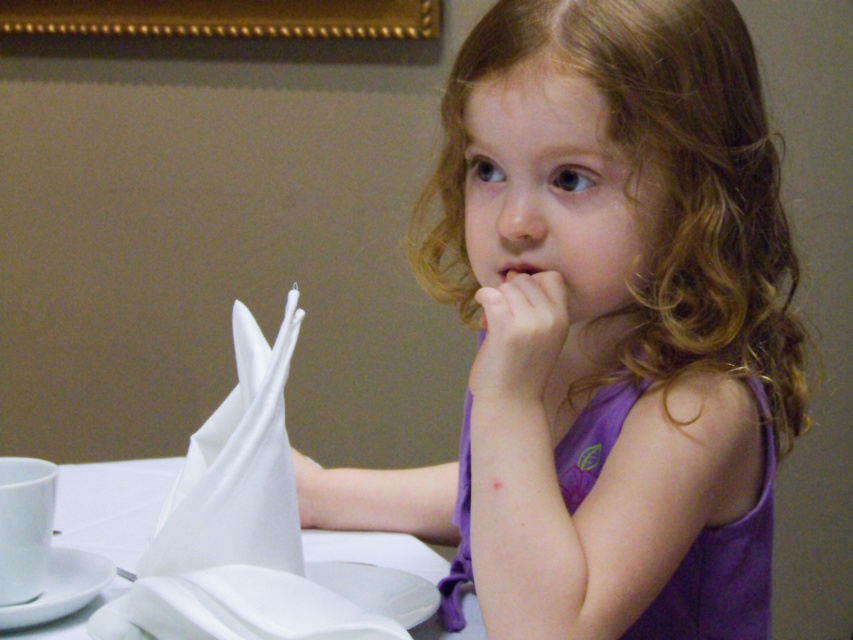
Question: Is purple fabric dress at center bigger than matte skin nose at center?

Choices:
 (A) yes
 (B) no

Answer: (A)

Question: Which object is farther from the camera taking this photo?

Choices:
 (A) matte pink lips at center
 (B) white paper napkin at upper left
 (C) purple fabric dress at center

Answer: (B)

Question: Is white paper napkin at upper left further to camera compared to pink flesh at center?

Choices:
 (A) yes
 (B) no

Answer: (A)

Question: Does purple fabric dress at center appear on the right side of matte skin nose at center?

Choices:
 (A) yes
 (B) no

Answer: (A)

Question: Which object is positioned closest to the smooth skin hand at center?

Choices:
 (A) matte skin nose at center
 (B) white paper napkin at upper left
 (C) purple fabric dress at center
 (D) matte pink lips at center

Answer: (D)

Question: Among these points, which one is farthest from the camera?

Choices:
 (A) (526, 260)
 (B) (167, 474)
 (C) (476, 292)
 (D) (45, 572)

Answer: (B)